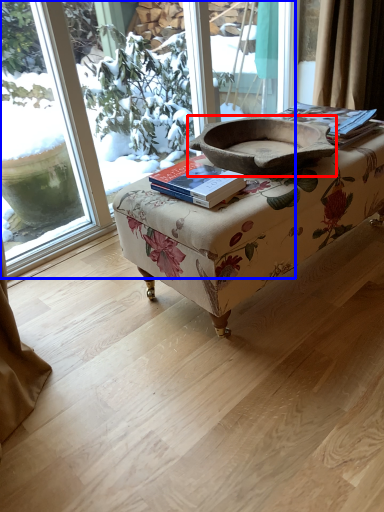
Question: Which object appears farthest to the camera in this image, footrest (highlighted by a red box) or window (highlighted by a blue box)?

Choices:
 (A) footrest
 (B) window

Answer: (B)